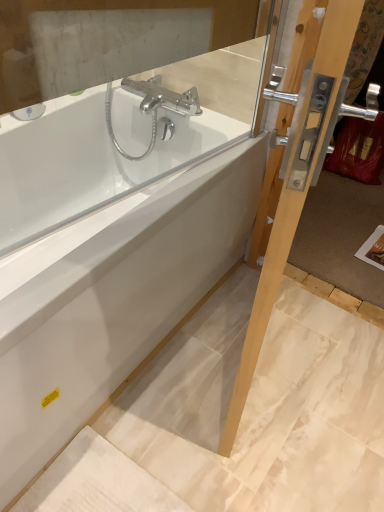
Identify the location of clear glass screen door at right. This screenshot has width=384, height=512. (293, 194).

Image resolution: width=384 pixels, height=512 pixels. What do you see at coordinates (293, 194) in the screenshot?
I see `clear glass screen door at right` at bounding box center [293, 194].

Describe the element at coordinates (111, 298) in the screenshot. I see `white glossy bathtub at center` at that location.

Where is `white glossy bathtub at center`? The width and height of the screenshot is (384, 512). white glossy bathtub at center is located at coordinates (111, 298).

Find the location of a particular element. clear glass screen door at right is located at coordinates (293, 194).

From the picture: Which is more to the right, clear glass screen door at right or white glossy bathtub at center?

clear glass screen door at right is more to the right.

Is the position of clear glass screen door at right more distant than that of white glossy bathtub at center?

No, clear glass screen door at right is closer to the camera.

Between point (286, 229) and point (93, 301), which one is positioned in front?

The point (286, 229) is in front.

From the image's perspective, is clear glass screen door at right over white glossy bathtub at center?

Indeed, from the image's perspective, clear glass screen door at right is shown above white glossy bathtub at center.

From a real-world perspective, who is located lower, clear glass screen door at right or white glossy bathtub at center?

white glossy bathtub at center.

Between clear glass screen door at right and white glossy bathtub at center, which one has smaller width?

clear glass screen door at right.

Considering the relative sizes of clear glass screen door at right and white glossy bathtub at center in the image provided, is clear glass screen door at right taller than white glossy bathtub at center?

Indeed, clear glass screen door at right has a greater height compared to white glossy bathtub at center.

Can you confirm if clear glass screen door at right is smaller than white glossy bathtub at center?

Correct, clear glass screen door at right occupies less space than white glossy bathtub at center.

Is clear glass screen door at right outside of white glossy bathtub at center?

That's correct, clear glass screen door at right is outside of white glossy bathtub at center.

Are clear glass screen door at right and white glossy bathtub at center beside each other?

No, clear glass screen door at right is not with white glossy bathtub at center.

Is white glossy bathtub at center at the back of clear glass screen door at right?

Absolutely, clear glass screen door at right is directed away from white glossy bathtub at center.

How many degrees apart are the facing directions of clear glass screen door at right and white glossy bathtub at center?

The angular difference between clear glass screen door at right and white glossy bathtub at center is 18 degrees.

This screenshot has height=512, width=384. In order to click on bathtub below the clear glass screen door at right (from a real-world perspective) in this screenshot , I will do `click(111, 298)`.

Can you confirm if white glossy bathtub at center is positioned to the left of clear glass screen door at right?

Yes, white glossy bathtub at center is to the left of clear glass screen door at right.

Is white glossy bathtub at center positioned in front of clear glass screen door at right?

No, it is not.

Which point is more distant from viewer, (166, 265) or (357, 13)?

The point (166, 265) is farther from the camera.

From the image's perspective, relative to clear glass screen door at right, is white glossy bathtub at center above or below?

white glossy bathtub at center is situated lower than clear glass screen door at right in the image.

From a real-world perspective, which is physically below, white glossy bathtub at center or clear glass screen door at right?

white glossy bathtub at center, from a real-world perspective.

Based on the photo, considering the sizes of white glossy bathtub at center and clear glass screen door at right in the image, is white glossy bathtub at center wider or thinner than clear glass screen door at right?

Considering their sizes, white glossy bathtub at center looks broader than clear glass screen door at right.

In terms of height, does white glossy bathtub at center look taller or shorter compared to clear glass screen door at right?

In the image, white glossy bathtub at center appears to be shorter than clear glass screen door at right.

Considering the sizes of white glossy bathtub at center and clear glass screen door at right in the image, is white glossy bathtub at center bigger or smaller than clear glass screen door at right?

Considering their sizes, white glossy bathtub at center takes up more space than clear glass screen door at right.

Is white glossy bathtub at center not inside clear glass screen door at right?

Yes.

From the picture: Is white glossy bathtub at center in contact with clear glass screen door at right?

No, white glossy bathtub at center is not making contact with clear glass screen door at right.

Is white glossy bathtub at center oriented towards clear glass screen door at right?

Yes, white glossy bathtub at center is aimed at clear glass screen door at right.

Can you tell me how much white glossy bathtub at center and clear glass screen door at right differ in facing direction?

There is a 18-degree angle between the facing directions of white glossy bathtub at center and clear glass screen door at right.

Looking at this image, measure the distance from white glossy bathtub at center to clear glass screen door at right.

A distance of 38.85 centimeters exists between white glossy bathtub at center and clear glass screen door at right.

Where is `screen door above the white glossy bathtub at center (from the image's perspective)`? screen door above the white glossy bathtub at center (from the image's perspective) is located at coordinates (293, 194).

The height and width of the screenshot is (512, 384). I want to click on bathtub lying on the left of clear glass screen door at right, so click(x=111, y=298).

Where is `screen door above the white glossy bathtub at center (from a real-world perspective)`? The image size is (384, 512). screen door above the white glossy bathtub at center (from a real-world perspective) is located at coordinates (293, 194).